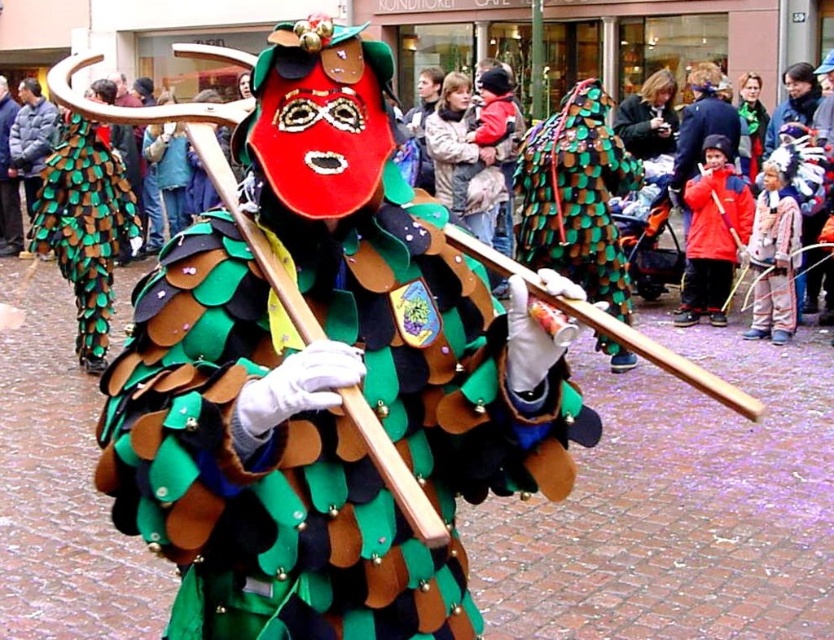
Measure the distance between point (234, 563) and camera.

Point (234, 563) and camera are 6.26 feet apart.

Locate an element on the screen. The width and height of the screenshot is (834, 640). green felt costume at center is located at coordinates (324, 380).

The height and width of the screenshot is (640, 834). I want to click on green felt costume at center, so click(x=324, y=380).

Between green felt costume at center and matte red mask at center, which one appears on the right side from the viewer's perspective?

From the viewer's perspective, matte red mask at center appears more on the right side.

Find the location of a particular element. This screenshot has height=640, width=834. green felt costume at center is located at coordinates (324, 380).

Who is more distant from viewer, (327,65) or (694,179)?

The point (694,179) is behind.

Image resolution: width=834 pixels, height=640 pixels. I want to click on green felt costume at center, so click(324, 380).

Which of these two, green textured scales at center or green felt scales at center, stands taller?

green textured scales at center is taller.

Where is `green textured scales at center`? green textured scales at center is located at coordinates (575, 196).